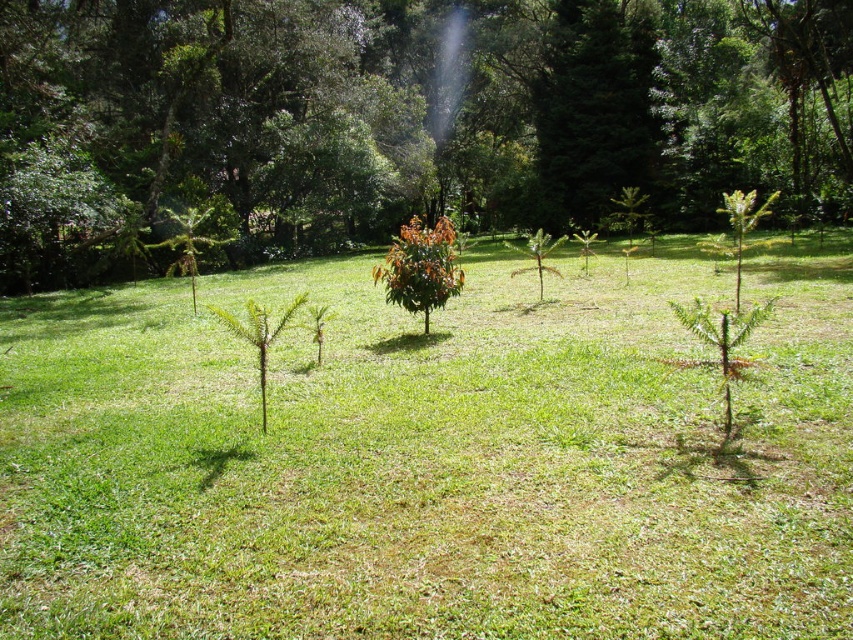
Question: Can you confirm if green grassy at center is positioned below green leafy tree at center?

Choices:
 (A) yes
 (B) no

Answer: (A)

Question: Which of the following is the farthest from the observer?

Choices:
 (A) green grassy at center
 (B) green leafy tree at center

Answer: (B)

Question: Can you confirm if green grassy at center is thinner than green leafy tree at center?

Choices:
 (A) no
 (B) yes

Answer: (B)

Question: Among these objects, which one is nearest to the camera?

Choices:
 (A) green leafy tree at center
 (B) green grassy at center

Answer: (B)

Question: Can you confirm if green grassy at center is bigger than green leafy tree at center?

Choices:
 (A) yes
 (B) no

Answer: (B)